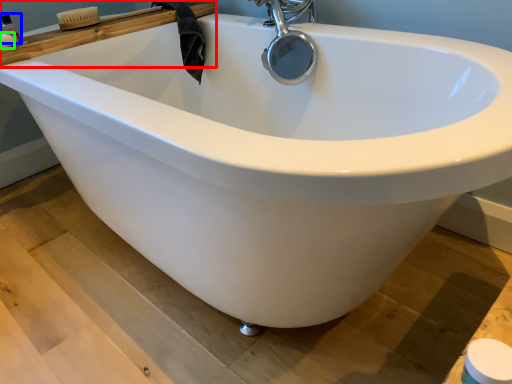
Question: Estimate the real-world distances between objects in this image. Which object is farther from ledge (highlighted by a red box), toiletry (highlighted by a blue box) or soap (highlighted by a green box)?

Choices:
 (A) toiletry
 (B) soap

Answer: (A)